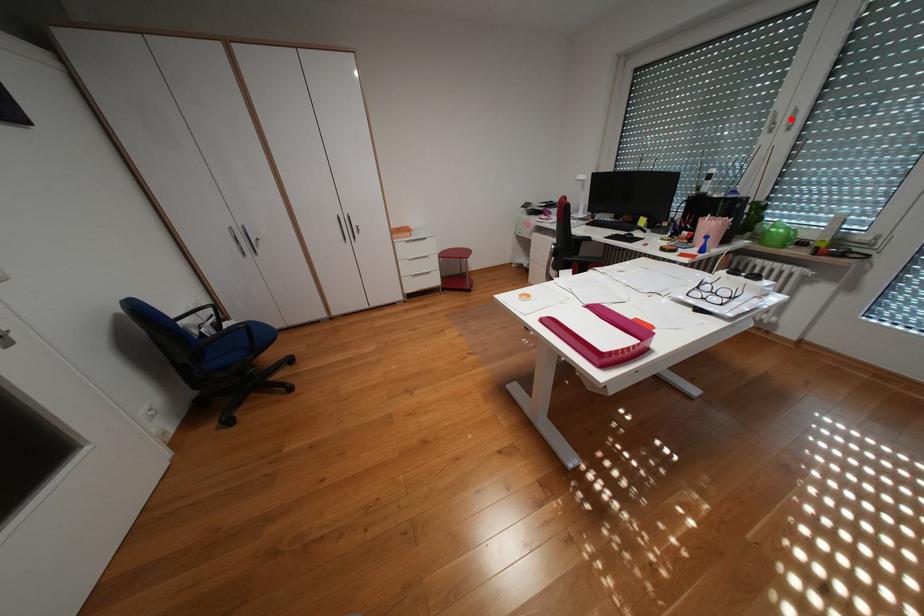
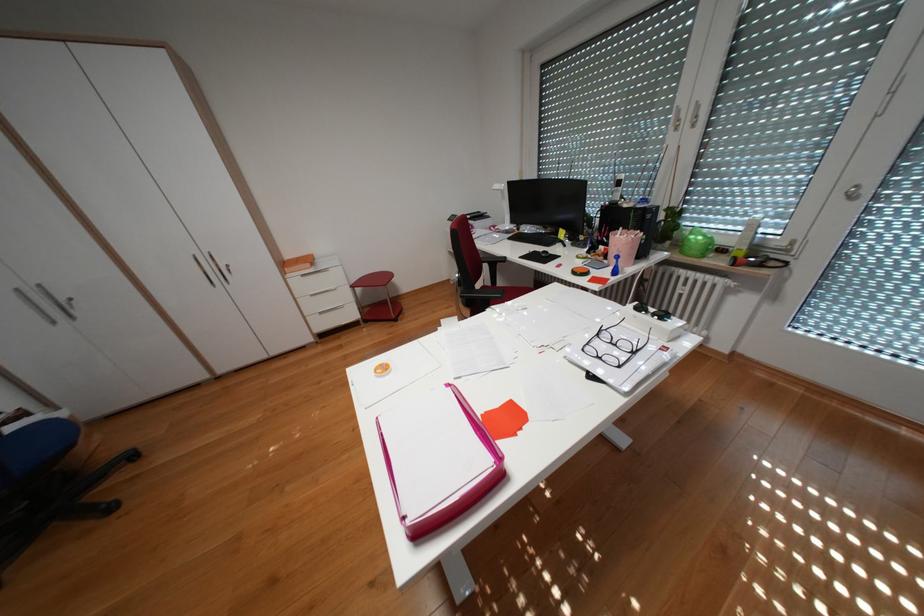
Question: I am providing you with two images of the same scene from different viewpoints. A red point is shown in image1. For the corresponding object point in image2, is it positioned nearer or farther from the camera?

Choices:
 (A) Nearer
 (B) Farther

Answer: (A)